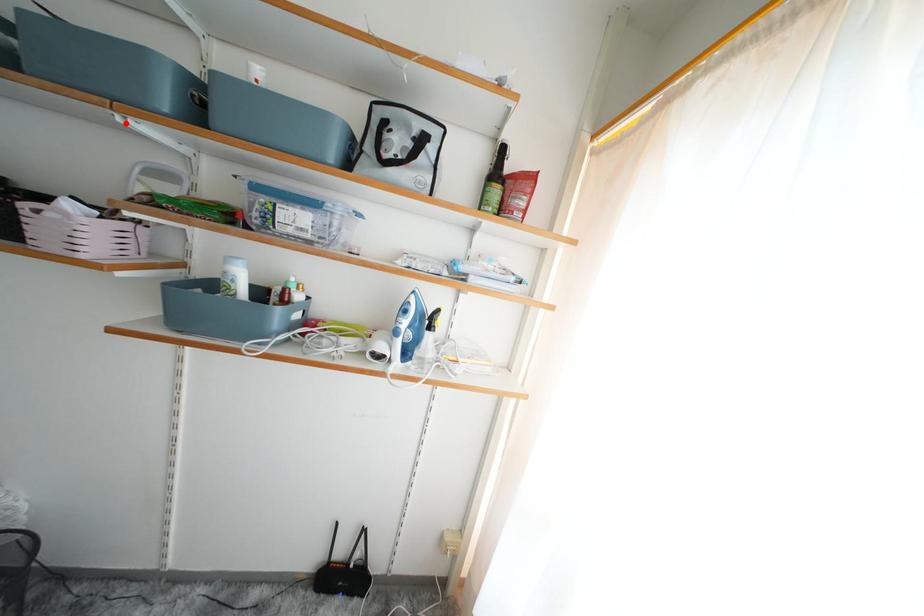
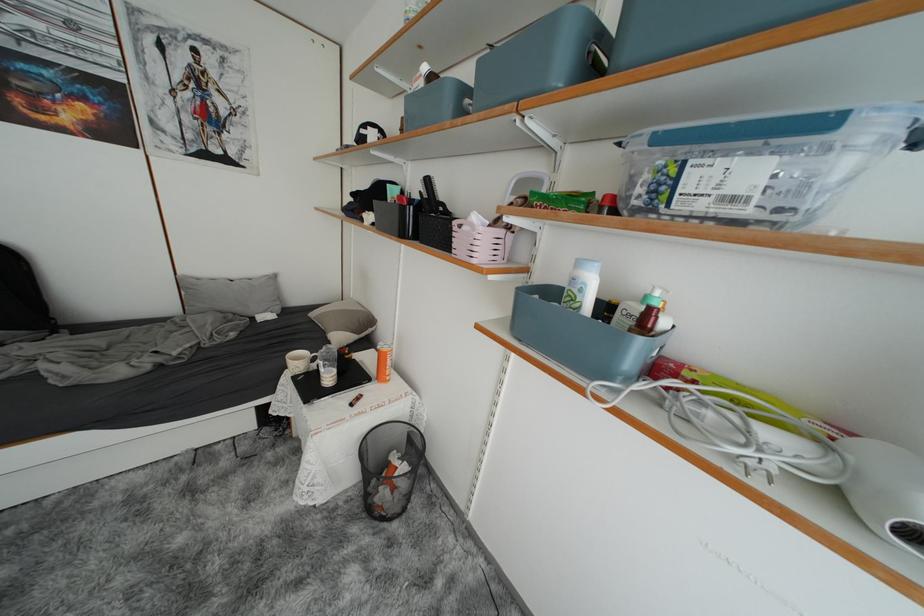
Locate, in the second image, the point that corresponds to the highlighted location in the first image.

(525, 127)